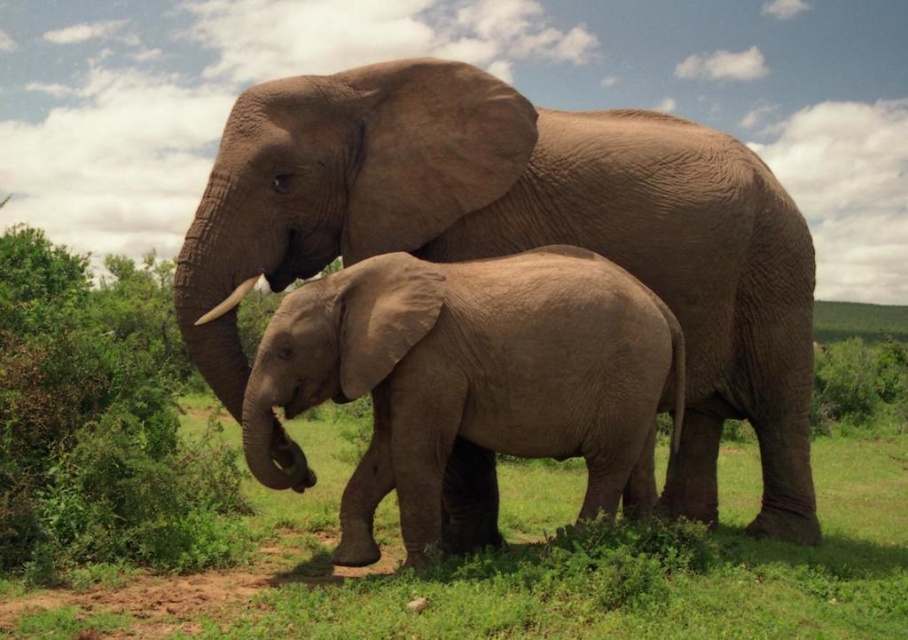
Question: Where is matte brown elephant at center located in relation to smooth gray elephant at center in the image?

Choices:
 (A) left
 (B) right

Answer: (B)

Question: Which object appears closest to the camera in this image?

Choices:
 (A) matte brown elephant at center
 (B) smooth gray elephant at center

Answer: (B)

Question: Is matte brown elephant at center behind smooth gray elephant at center?

Choices:
 (A) no
 (B) yes

Answer: (B)

Question: Can you confirm if matte brown elephant at center is smaller than smooth gray elephant at center?

Choices:
 (A) no
 (B) yes

Answer: (A)

Question: Which point appears farthest from the camera in this image?

Choices:
 (A) (681, 360)
 (B) (369, 218)

Answer: (B)